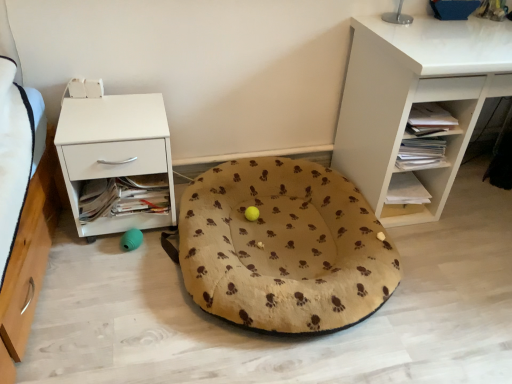
Question: Does point (449, 57) appear closer or farther from the camera than point (126, 226)?

Choices:
 (A) closer
 (B) farther

Answer: (A)

Question: Would you say white matte desk at upper right, arranged as the 1th shelf when viewed from the top, is to the left or to the right of white matte nightstand at left in the picture?

Choices:
 (A) left
 (B) right

Answer: (B)

Question: Considering the real-world distances, which object is farthest from the white matte nightstand at left?

Choices:
 (A) metallic silver table lamp at upper center
 (B) white matte shelf at center right, the 2th shelf viewed from the top
 (C) beige fabric dog bed at center
 (D) white matte desk at upper right, the 2th shelf when ordered from bottom to top

Answer: (A)

Question: Estimate the real-world distances between objects in this image. Which object is closer to the metallic silver table lamp at upper center?

Choices:
 (A) white matte nightstand at left
 (B) white matte shelf at center right, the 2th shelf viewed from the top
 (C) white matte desk at upper right, the 2th shelf when ordered from bottom to top
 (D) beige fabric dog bed at center

Answer: (C)